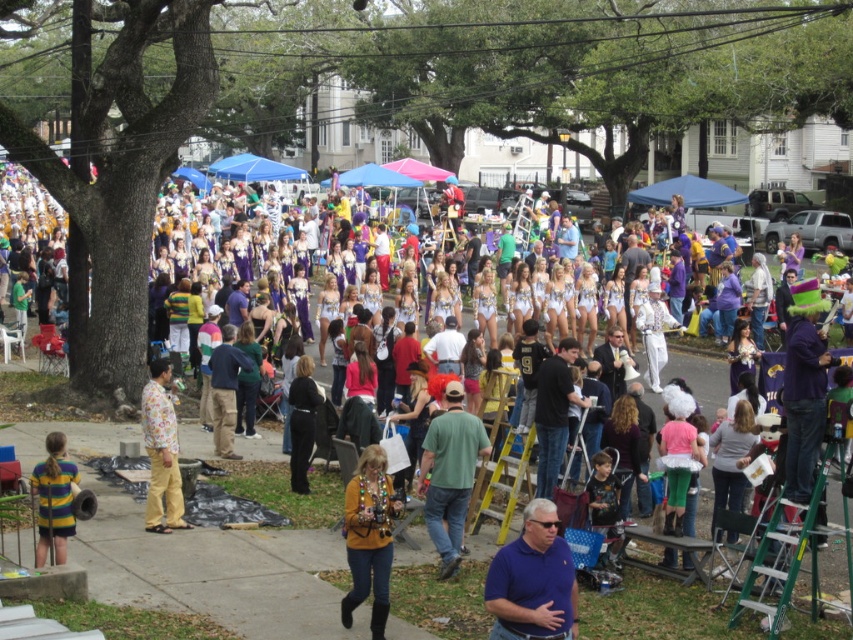
Does blue shirt at lower center appear under floral-patterned shirt at center?

Correct, blue shirt at lower center is located below floral-patterned shirt at center.

Who is taller, blue shirt at lower center or floral-patterned shirt at center?

With more height is floral-patterned shirt at center.

In order to click on blue shirt at lower center in this screenshot , I will do `click(532, 580)`.

Between yellow sweater at center and black leather jacket at center, which one has less height?

Standing shorter between the two is yellow sweater at center.

Is point (376, 548) positioned after point (310, 403)?

No, (376, 548) is closer to viewer.

This screenshot has width=853, height=640. What are the coordinates of `yellow sweater at center` in the screenshot? It's located at (369, 536).

Can you confirm if yellow sweater at center is bigger than floral-patterned shirt at center?

Indeed, yellow sweater at center has a larger size compared to floral-patterned shirt at center.

Who is positioned more to the right, yellow sweater at center or floral-patterned shirt at center?

yellow sweater at center is more to the right.

Does point (387, 518) lie behind point (143, 406)?

No, (387, 518) is closer to viewer.

Where is `yellow sweater at center`? The width and height of the screenshot is (853, 640). yellow sweater at center is located at coordinates (369, 536).